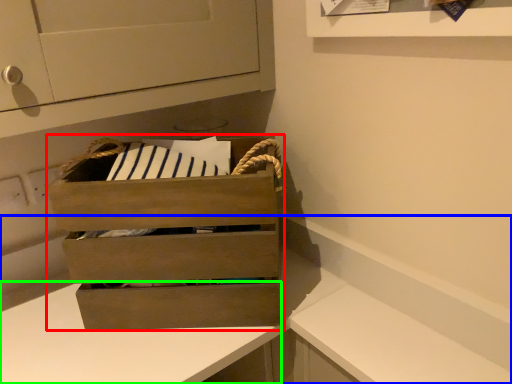
Question: Considering the real-world distances, which object is closest to chest of drawers (highlighted by a red box)? counter (highlighted by a blue box) or counter (highlighted by a green box).

Choices:
 (A) counter
 (B) counter

Answer: (B)